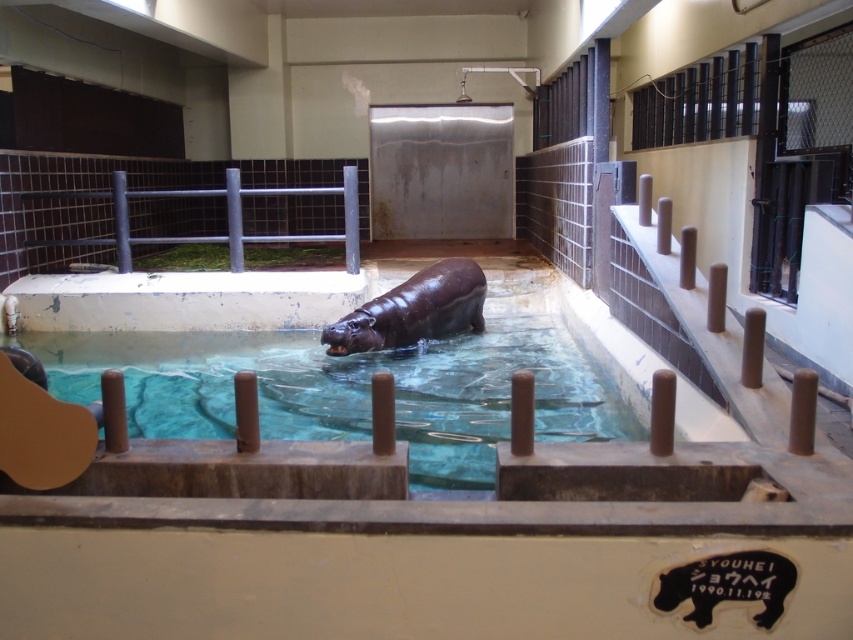
Can you confirm if translucent glass pool at center is positioned above shiny brown hippo at center?

No.

Locate an element on the screen. The width and height of the screenshot is (853, 640). translucent glass pool at center is located at coordinates (352, 388).

Looking at this image, which is more to the left, metallic gray rail at upper left or shiny brown hippo at center?

metallic gray rail at upper left is more to the left.

Based on the photo, does metallic gray rail at upper left appear on the right side of shiny brown hippo at center?

In fact, metallic gray rail at upper left is to the left of shiny brown hippo at center.

At what (x,y) coordinates should I click in order to perform the action: click on metallic gray rail at upper left. Please return your answer as a coordinate pair (x, y). The image size is (853, 640). Looking at the image, I should click on (225, 218).

Is point (596, 420) closer to viewer compared to point (329, 236)?

Yes, point (596, 420) is in front of point (329, 236).

Who is shorter, translucent glass pool at center or metallic gray rail at upper left?

Standing shorter between the two is translucent glass pool at center.

Does point (483, 353) come in front of point (228, 177)?

That is True.

Identify the location of translucent glass pool at center. This screenshot has height=640, width=853. (352, 388).